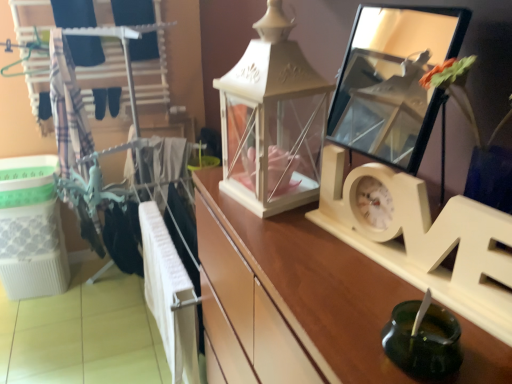
Question: From their relative heights in the image, would you say green glass candle holder at lower right is taller or shorter than clear glass mirror at upper right?

Choices:
 (A) tall
 (B) short

Answer: (B)

Question: Considering the positions of point (456, 354) and point (342, 125), is point (456, 354) closer or farther from the camera than point (342, 125)?

Choices:
 (A) farther
 (B) closer

Answer: (B)

Question: Estimate the real-world distances between objects in this image. Which object is farther from the clear glass mirror at upper right?

Choices:
 (A) white wood clock at center
 (B) white matte lantern at center
 (C) green glass candle holder at lower right
 (D) wooden drawer at center
 (E) plaid fabric at left

Answer: (C)

Question: Which object is positioned farthest from the plaid fabric at left?

Choices:
 (A) green glass candle holder at lower right
 (B) white matte lantern at center
 (C) wooden drawer at center
 (D) white wood clock at center
 (E) clear glass mirror at upper right

Answer: (E)